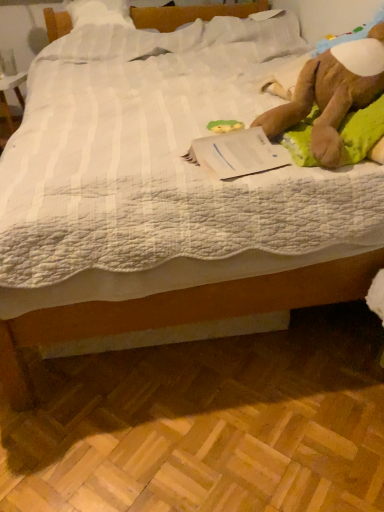
Question: Should I look upward or downward to see green rubber duck at center?

Choices:
 (A) down
 (B) up

Answer: (B)

Question: Can you confirm if brown plush toy at upper right is wider than white paper at upper right?

Choices:
 (A) no
 (B) yes

Answer: (B)

Question: Could you tell me if brown plush toy at upper right is facing white paper at upper right?

Choices:
 (A) no
 (B) yes

Answer: (A)

Question: Considering the relative sizes of brown plush toy at upper right and white paper at upper right in the image provided, is brown plush toy at upper right thinner than white paper at upper right?

Choices:
 (A) no
 (B) yes

Answer: (A)

Question: Can you confirm if brown plush toy at upper right is positioned to the left of white paper at upper right?

Choices:
 (A) yes
 (B) no

Answer: (B)

Question: Is brown plush toy at upper right looking in the opposite direction of white paper at upper right?

Choices:
 (A) no
 (B) yes

Answer: (A)

Question: Is white paper at upper right located within brown plush toy at upper right?

Choices:
 (A) yes
 (B) no

Answer: (B)

Question: Is green rubber duck at center positioned with its back to white paper at upper right?

Choices:
 (A) yes
 (B) no

Answer: (B)

Question: From the image's perspective, is green rubber duck at center on top of white paper at upper right?

Choices:
 (A) yes
 (B) no

Answer: (A)

Question: From a real-world perspective, is green rubber duck at center positioned over white paper at upper right based on gravity?

Choices:
 (A) no
 (B) yes

Answer: (A)

Question: Is the position of green rubber duck at center less distant than that of white paper at upper right?

Choices:
 (A) no
 (B) yes

Answer: (A)

Question: Are green rubber duck at center and white paper at upper right located far from each other?

Choices:
 (A) yes
 (B) no

Answer: (B)

Question: Is green rubber duck at center aimed at white paper at upper right?

Choices:
 (A) yes
 (B) no

Answer: (B)

Question: Considering the relative sizes of brown plush toy at upper right and green rubber duck at center in the image provided, is brown plush toy at upper right shorter than green rubber duck at center?

Choices:
 (A) yes
 (B) no

Answer: (B)